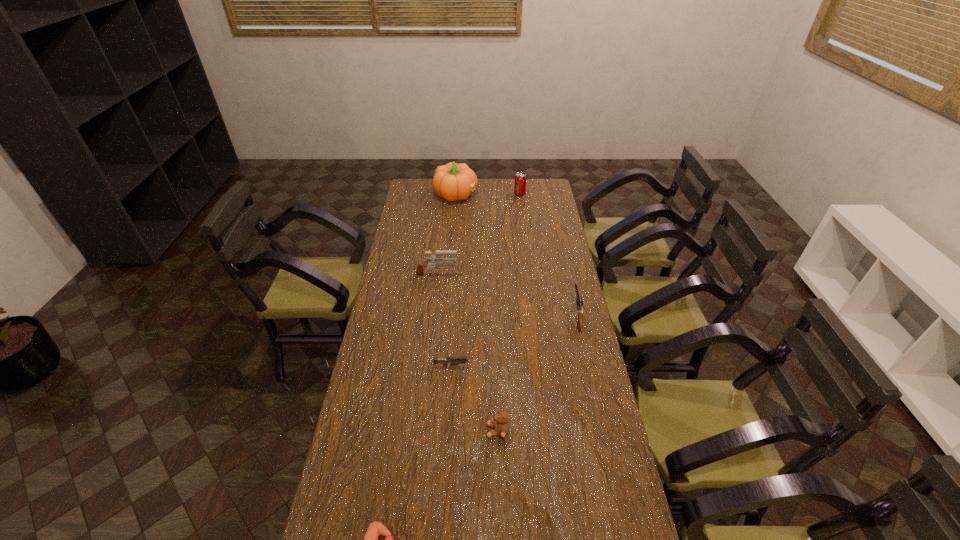
In the image, there is a desktop. Where is `free region at the right edge`? This screenshot has height=540, width=960. free region at the right edge is located at coordinates (571, 348).

Identify the location of vacant area at the far left corner. (412, 185).

At what (x,y) coordinates should I click in order to perform the action: click on free point at the far right corner. Please return your answer as a coordinate pair (x, y). The image size is (960, 540). Looking at the image, I should click on (544, 185).

The height and width of the screenshot is (540, 960). Find the location of `unoccupied area between the nearest gun and the tallest object`. unoccupied area between the nearest gun and the tallest object is located at coordinates (456, 280).

Locate an element on the screen. The image size is (960, 540). vacant space in between the tallest object and the fifth nearest object is located at coordinates (446, 235).

Identify the location of vacant area between the tallest gun and the sixth object from left to right. The image size is (960, 540). (478, 235).

Identify the location of vacant point located between the pumpkin and the tallest gun. (446, 235).

Choose which object is the nearest neighbor to the soda can. Please provide its 2D coordinates. Your answer should be formatted as a tuple, i.e. [(x, y)], where the tuple contains the x and y coordinates of a point satisfying the conditions above.

[(453, 181)]

Locate an element on the screen. This screenshot has width=960, height=540. object that stands as the fifth closest to the pumpkin is located at coordinates (501, 426).

You are a GUI agent. You are given a task and a screenshot of the screen. Output one action in this format:
    pyautogui.click(x=<x>, y=<y>)
    Task: Click on the third closest gun relative to the fifth object from left to right
    Image resolution: width=960 pixels, height=540 pixels.
    Given the screenshot: What is the action you would take?
    pyautogui.click(x=439, y=260)